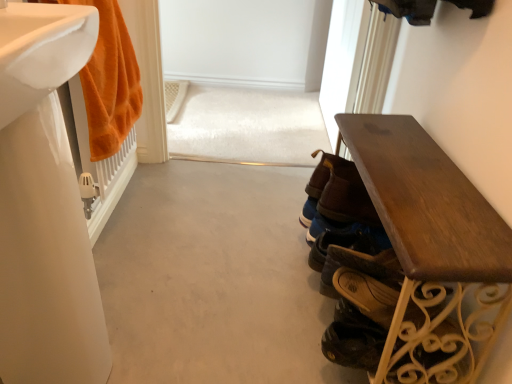
Question: Would you say orange plush towel at left is outside wooden bench at right?

Choices:
 (A) no
 (B) yes

Answer: (B)

Question: Is wooden bench at right inside orange plush towel at left?

Choices:
 (A) no
 (B) yes

Answer: (A)

Question: Considering the relative sizes of orange plush towel at left and wooden bench at right in the image provided, is orange plush towel at left taller than wooden bench at right?

Choices:
 (A) yes
 (B) no

Answer: (B)

Question: Does orange plush towel at left come behind wooden bench at right?

Choices:
 (A) no
 (B) yes

Answer: (B)

Question: From the image's perspective, is orange plush towel at left located above wooden bench at right?

Choices:
 (A) yes
 (B) no

Answer: (A)

Question: Does point (31, 43) appear closer or farther from the camera than point (140, 89)?

Choices:
 (A) farther
 (B) closer

Answer: (B)

Question: From their relative heights in the image, would you say white glossy sink at left, which appears as the first sink when viewed from the top, is taller or shorter than orange plush towel at left?

Choices:
 (A) tall
 (B) short

Answer: (B)

Question: Is white glossy sink at left, which appears as the first sink when viewed from the top, situated inside orange plush towel at left or outside?

Choices:
 (A) outside
 (B) inside

Answer: (A)

Question: Considering their positions, is white glossy sink at left, which appears as the first sink when viewed from the top, located in front of or behind orange plush towel at left?

Choices:
 (A) behind
 (B) front

Answer: (B)

Question: Relative to brown leather shoes at center, acting as the second footwear starting from the front, is white glossy sink at left, which appears as the first sink when viewed from the top, in front or behind?

Choices:
 (A) behind
 (B) front

Answer: (B)

Question: Do you think white glossy sink at left, which appears as the first sink when viewed from the top, is within brown leather shoes at center, acting as the second footwear starting from the front, or outside of it?

Choices:
 (A) outside
 (B) inside

Answer: (A)

Question: From the image's perspective, is white glossy sink at left, which appears as the first sink when viewed from the top, positioned above or below brown leather shoes at center, acting as the second footwear starting from the front?

Choices:
 (A) below
 (B) above

Answer: (B)

Question: From a real-world perspective, is white glossy sink at left, which appears as the first sink when viewed from the top, physically located above or below brown leather shoes at center, the first footwear viewed from the back?

Choices:
 (A) below
 (B) above

Answer: (B)

Question: From a real-world perspective, relative to white glossy sink at left, which is the second sink from top to bottom, is brown leather shoe at lower right, which is counted as the 1th shoe, starting from the top, vertically above or below?

Choices:
 (A) below
 (B) above

Answer: (A)

Question: Considering the positions of point (381, 292) and point (53, 89), is point (381, 292) closer or farther from the camera than point (53, 89)?

Choices:
 (A) closer
 (B) farther

Answer: (B)